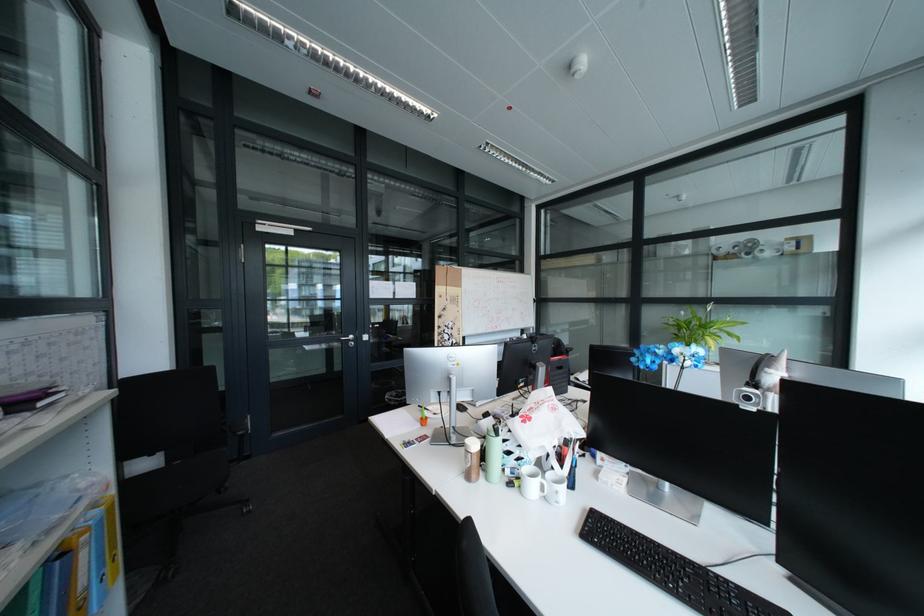
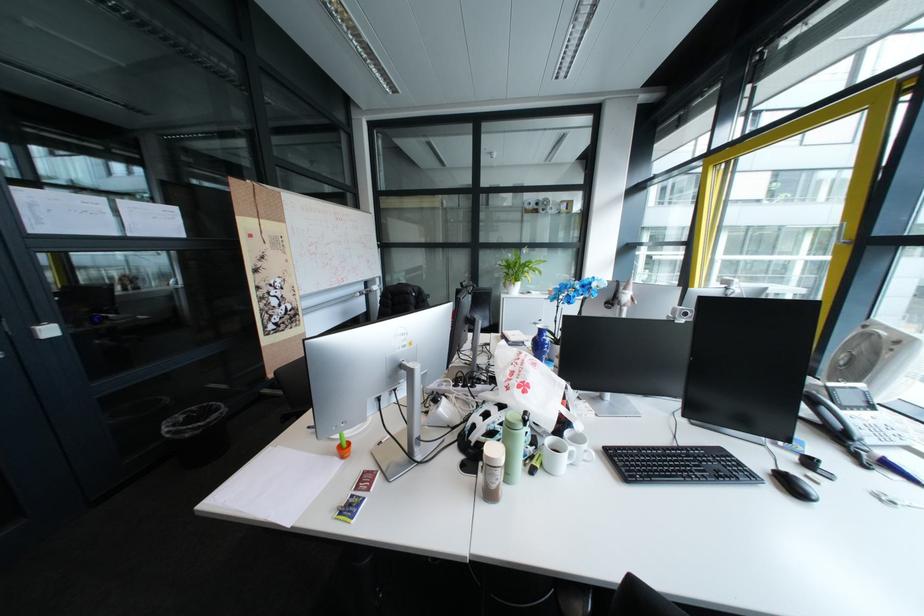
In the second image, find the point that corresponds to (x=432, y=421) in the first image.

(341, 454)